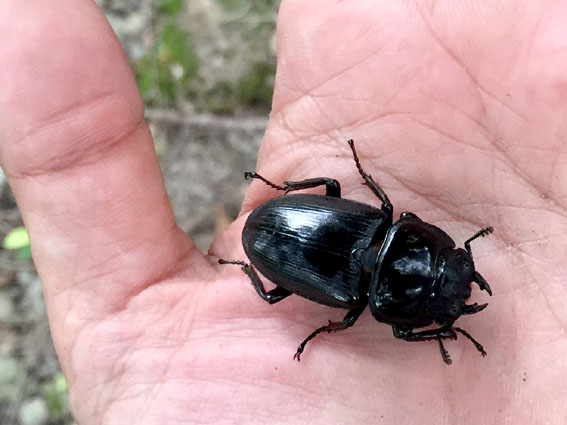
Locate an element on the screen. green plant is located at coordinates click(494, 130).